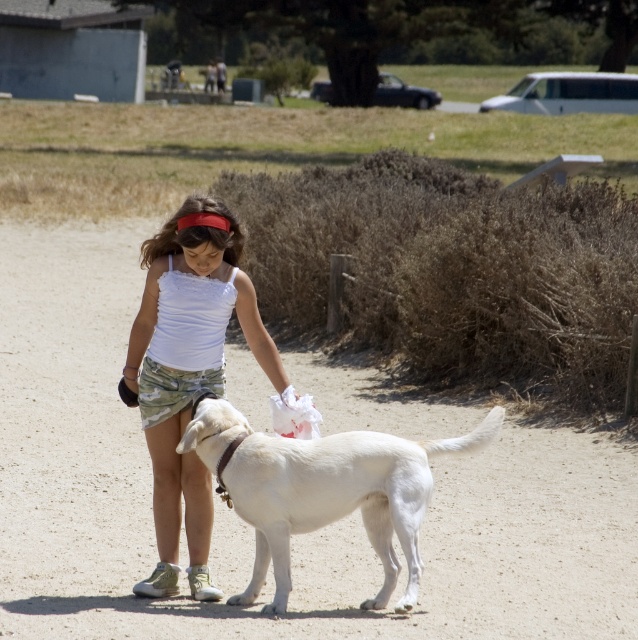
Is dirt track at center positioned before white cotton tank top at center?

That is True.

Who is positioned more to the left, dirt track at center or white cotton tank top at center?

dirt track at center

Measure the distance between point (195, 625) and camera.

The distance of point (195, 625) from camera is 8.04 meters.

This screenshot has width=638, height=640. I want to click on dirt track at center, so click(249, 525).

Which of these two, white cotton tank top at center or white matte dog at center, stands shorter?

Standing shorter between the two is white cotton tank top at center.

Looking at this image, can you confirm if white cotton tank top at center is thinner than white matte dog at center?

Yes.

Who is more distant from viewer, (135,401) or (422,440)?

Point (422,440)

This screenshot has height=640, width=638. What are the coordinates of `white cotton tank top at center` in the screenshot? It's located at (188, 371).

Does point (13, 380) come behind point (276, 445)?

Yes, it is behind point (276, 445).

Can you confirm if dirt track at center is positioned below white matte dog at center?

Actually, dirt track at center is above white matte dog at center.

Where is `dirt track at center`? The image size is (638, 640). dirt track at center is located at coordinates (249, 525).